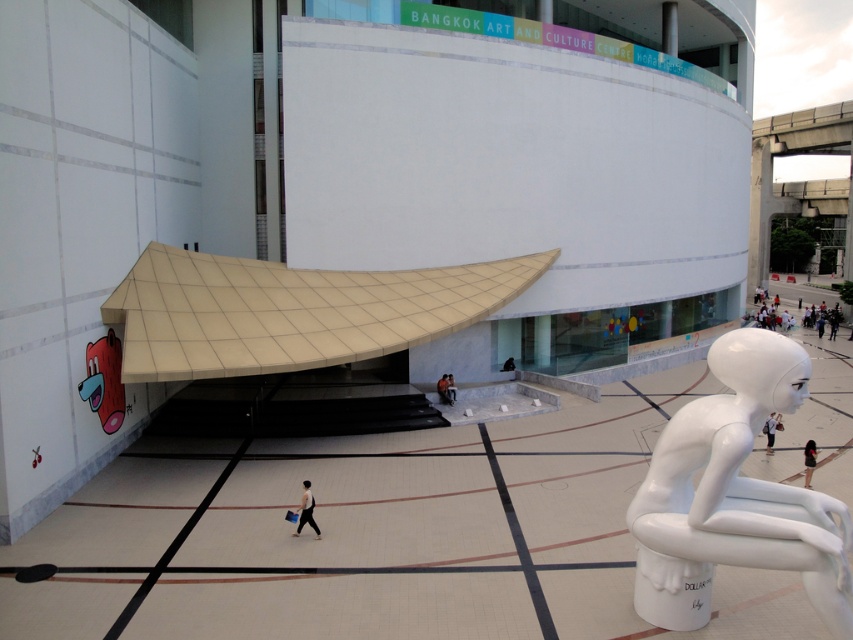
You are visiting the Bangkok Art and Culture Centre and want to take a photo of both the black fabric person at lower right and the white glossy statue at lower right. Since you want both in the frame, will you need to zoom in or zoom out your camera?

The black fabric person at lower right is smaller than the white glossy statue at lower right. To include both in the frame without cropping either, you should zoom out to capture the larger statue and the smaller person together.

You are an architect visiting the Bangkok Art and Culture Centre. You notice the beige tile canopy at center and the white glossy sculpture at right. Which object would cast a longer shadow at noon when the sun is directly overhead?

The beige tile canopy at center is much taller than the white glossy sculpture at right, so it would cast a longer shadow at noon when the sun is directly overhead.

You are standing in front of the Bangkok Art and Culture Centre and notice a light gray fabric bag at lower center. Based on its position, can you determine if it is placed closer to the entrance or the sculpture?

The light gray fabric bag at lower center is located at point (306, 509), which places it closer to the entrance of the Bangkok Art and Culture Centre rather than the sculpture in the foreground.